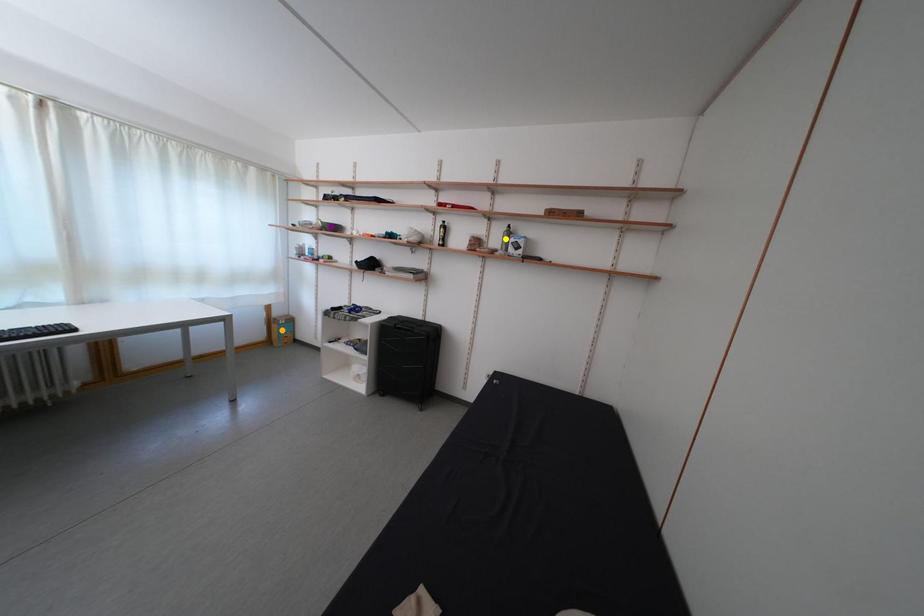
Order these from nearest to farthest:
yellow point | orange point | purple point

yellow point, purple point, orange point